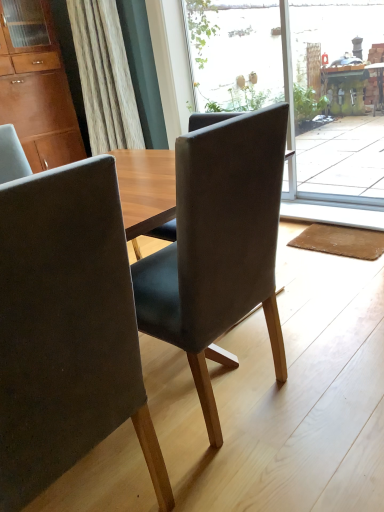
Image resolution: width=384 pixels, height=512 pixels. I want to click on free space in front of suede-like gray chair at center, the 2th chair positioned from the left, so click(257, 470).